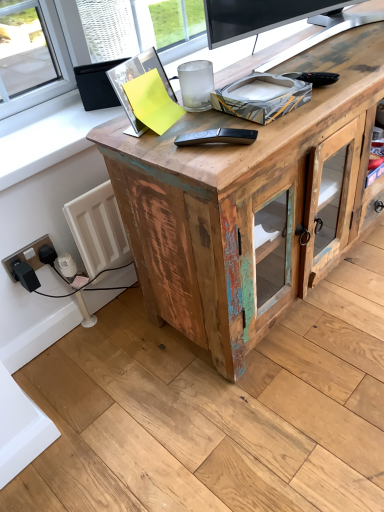
Find the location of `free space above weathered wood desk at center (from a real-world perspective)`. free space above weathered wood desk at center (from a real-world perspective) is located at coordinates (318, 47).